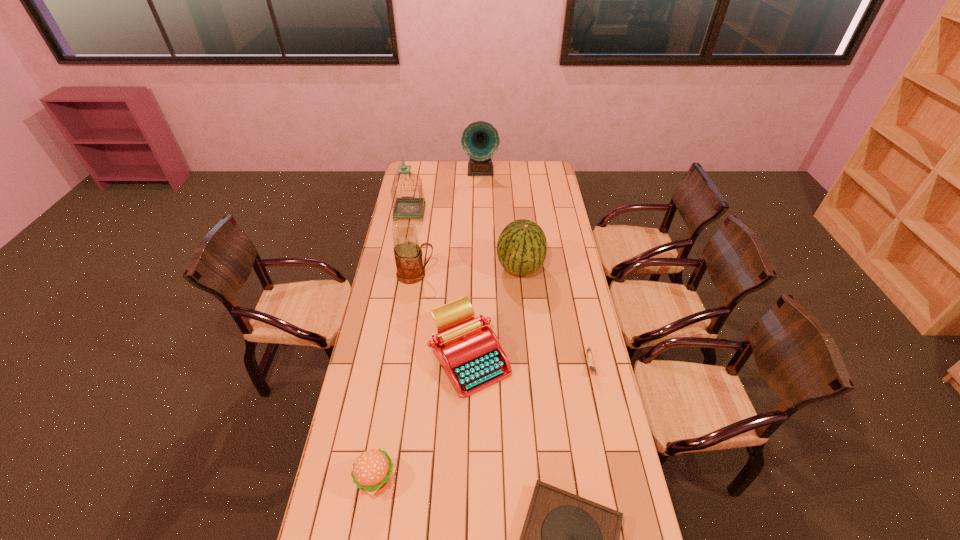
Find the location of `banana present at the right edge`. banana present at the right edge is located at coordinates (590, 362).

Where is `free region at the left edge of the desktop`? This screenshot has height=540, width=960. free region at the left edge of the desktop is located at coordinates (343, 438).

Locate an element on the screen. vacant area at the right edge of the desktop is located at coordinates (611, 474).

You are a GUI agent. You are given a task and a screenshot of the screen. Output one action in this format:
    pyautogui.click(x=<x>, y=<y>)
    Task: Click on the vacant space at the far left corner of the desktop
    This screenshot has width=960, height=540.
    Given the screenshot: What is the action you would take?
    pyautogui.click(x=427, y=172)

Find the location of a particular element. free space at the far right corner of the desktop is located at coordinates (555, 180).

In order to click on free space that is in between the fifth tallest object and the birdcage in this screenshot , I will do `click(440, 285)`.

Where is `free spot between the pitcher and the watermelon`? The image size is (960, 540). free spot between the pitcher and the watermelon is located at coordinates (468, 271).

You are a GUI agent. You are given a task and a screenshot of the screen. Output one action in this format:
    pyautogui.click(x=<x>, y=<y>)
    Task: Click on the empty space that is in between the pitcher and the second shortest object
    The image size is (960, 540).
    Given the screenshot: What is the action you would take?
    pyautogui.click(x=503, y=320)

Locate an element on the screen. The height and width of the screenshot is (540, 960). vacant space in between the typewriter and the watermelon is located at coordinates (495, 313).

The width and height of the screenshot is (960, 540). What are the coordinates of `free space between the second shortest object and the pitcher` in the screenshot? It's located at (503, 320).